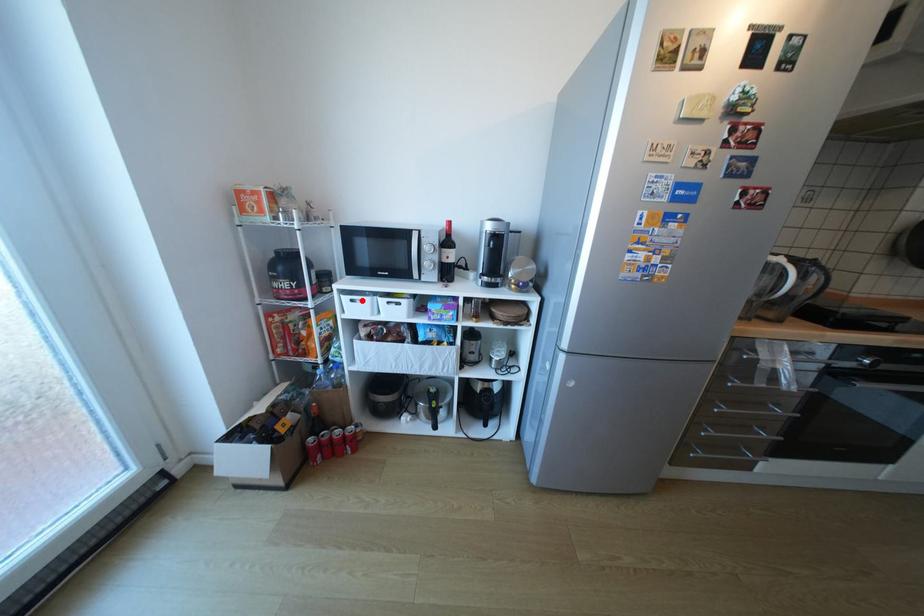
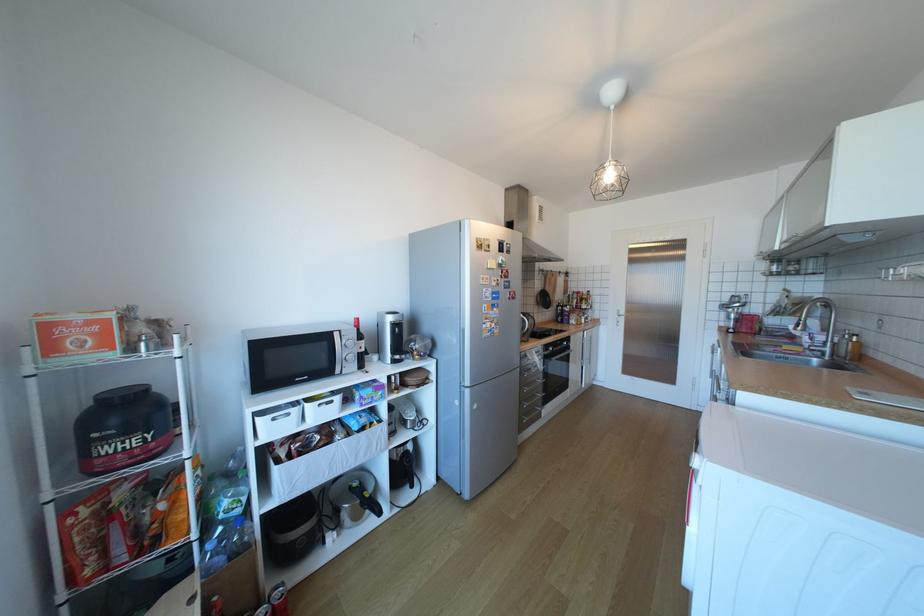
In the second image, find the point that corresponds to the highlighted location in the first image.

(283, 419)